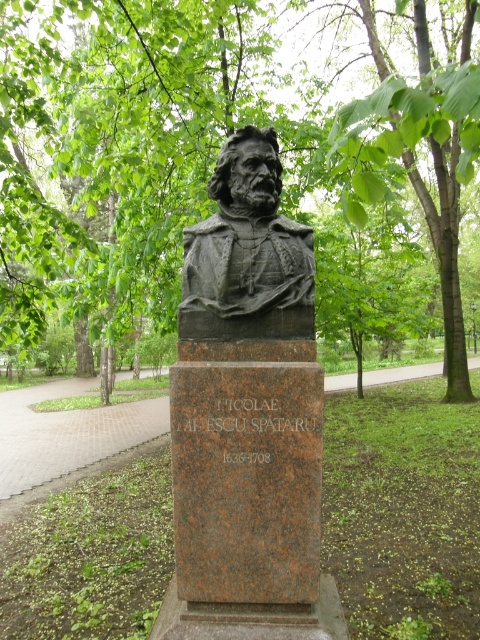
Between point (189, 324) and point (229, 211), which one is positioned behind?

The point (229, 211) is behind.

Between point (300, 387) and point (274, 212), which one is positioned behind?

The point (274, 212) is more distant.

Find the location of a particular element. This screenshot has width=480, height=640. brown granite bust at center is located at coordinates (247, 392).

Can you confirm if green leafy tree at upper center is positioned to the right of dark gray stone bust at center?

Incorrect, green leafy tree at upper center is not on the right side of dark gray stone bust at center.

This screenshot has width=480, height=640. Describe the element at coordinates (115, 136) in the screenshot. I see `green leafy tree at upper center` at that location.

Between point (141, 241) and point (253, 188), which one is positioned in front?

Point (253, 188)

I want to click on green leafy tree at upper center, so click(x=115, y=136).

Can you confirm if green leafy tree at upper center is shorter than brown granite bust at center?

Yes, green leafy tree at upper center is shorter than brown granite bust at center.

Is point (94, 156) farther from camera compared to point (256, 573)?

Yes, it is behind point (256, 573).

Does point (0, 301) come in front of point (282, 227)?

No, (0, 301) is behind (282, 227).

The height and width of the screenshot is (640, 480). I want to click on green leafy tree at upper center, so click(115, 136).